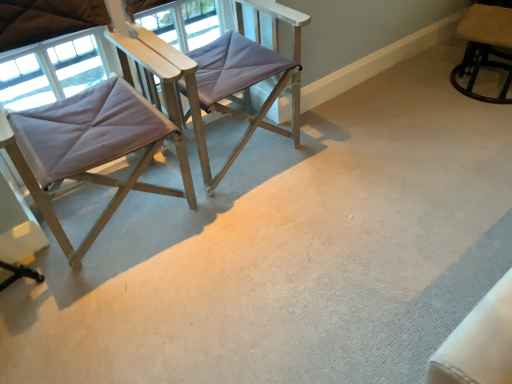
This screenshot has height=384, width=512. I want to click on matte purple fabric chair at center, marked as the second chair in a left-to-right arrangement, so click(229, 77).

Locate an element on the screen. The width and height of the screenshot is (512, 384). matte gray fabric chair at left, placed as the 3th chair when sorted from right to left is located at coordinates pos(91,148).

Where is `matte purple fabric chair at center, marked as the second chair in a left-to-right arrangement`? The image size is (512, 384). matte purple fabric chair at center, marked as the second chair in a left-to-right arrangement is located at coordinates (229, 77).

Which is in front, matte purple fabric chair at center, marked as the 2th chair in a right-to-left arrangement, or matte gray fabric chair at left, marked as the first chair in a left-to-right arrangement?

matte gray fabric chair at left, marked as the first chair in a left-to-right arrangement.

Is there a large distance between matte purple fabric chair at center, marked as the second chair in a left-to-right arrangement, and matte gray fabric chair at left, placed as the 3th chair when sorted from right to left?

They are positioned close to each other.

Where is `chair in front of the matte purple fabric chair at center, marked as the 2th chair in a right-to-left arrangement`? chair in front of the matte purple fabric chair at center, marked as the 2th chair in a right-to-left arrangement is located at coordinates (91, 148).

Can you confirm if matte purple fabric chair at center, marked as the 2th chair in a right-to-left arrangement, is taller than matte gray fabric chair at left, placed as the 3th chair when sorted from right to left?

In fact, matte purple fabric chair at center, marked as the 2th chair in a right-to-left arrangement, may be shorter than matte gray fabric chair at left, placed as the 3th chair when sorted from right to left.

Is beige fabric chair at upper right, the first chair when ordered from right to left, closer to camera compared to matte gray fabric chair at left, marked as the first chair in a left-to-right arrangement?

No, it is not.

In the scene shown: From the image's perspective, between beige fabric chair at upper right, which is counted as the 3th chair, starting from the left, and matte gray fabric chair at left, placed as the 3th chair when sorted from right to left, who is located below?

From the image's view, matte gray fabric chair at left, placed as the 3th chair when sorted from right to left, is below.

Which point is more forward, (504, 90) or (31, 164)?

The point (31, 164) is closer.

Does matte gray fabric chair at left, placed as the 3th chair when sorted from right to left, appear on the left side of matte purple fabric chair at center, marked as the second chair in a left-to-right arrangement?

Correct, you'll find matte gray fabric chair at left, placed as the 3th chair when sorted from right to left, to the left of matte purple fabric chair at center, marked as the second chair in a left-to-right arrangement.

Does matte gray fabric chair at left, marked as the first chair in a left-to-right arrangement, turn towards matte purple fabric chair at center, marked as the 2th chair in a right-to-left arrangement?

No, matte gray fabric chair at left, marked as the first chair in a left-to-right arrangement, is not turned towards matte purple fabric chair at center, marked as the 2th chair in a right-to-left arrangement.

Starting from the matte gray fabric chair at left, marked as the first chair in a left-to-right arrangement, which chair is the 1st one to the right? Please provide its 2D coordinates.

[(229, 77)]

Which is closer to the camera, (48, 204) or (250, 82)?

Point (48, 204) is positioned closer to the camera compared to point (250, 82).

In the image, is matte purple fabric chair at center, marked as the second chair in a left-to-right arrangement, positioned in front of or behind beige fabric chair at upper right, which is counted as the 3th chair, starting from the left?

matte purple fabric chair at center, marked as the second chair in a left-to-right arrangement, is positioned closer to the viewer than beige fabric chair at upper right, which is counted as the 3th chair, starting from the left.

Choose the correct answer: Is matte purple fabric chair at center, marked as the second chair in a left-to-right arrangement, inside beige fabric chair at upper right, which is counted as the 3th chair, starting from the left, or outside it?

The correct answer is: outside.

Does point (250, 120) come in front of point (485, 38)?

No, (250, 120) is behind (485, 38).

Considering the relative sizes of matte purple fabric chair at center, marked as the 2th chair in a right-to-left arrangement, and beige fabric chair at upper right, the first chair when ordered from right to left, in the image provided, is matte purple fabric chair at center, marked as the 2th chair in a right-to-left arrangement, smaller than beige fabric chair at upper right, the first chair when ordered from right to left,?

Actually, matte purple fabric chair at center, marked as the 2th chair in a right-to-left arrangement, might be larger than beige fabric chair at upper right, the first chair when ordered from right to left.

Locate an element on the screen. chair below the matte purple fabric chair at center, marked as the second chair in a left-to-right arrangement (from a real-world perspective) is located at coordinates click(x=484, y=47).

Considering the relative sizes of beige fabric chair at upper right, the first chair when ordered from right to left, and matte purple fabric chair at center, marked as the second chair in a left-to-right arrangement, in the image provided, is beige fabric chair at upper right, the first chair when ordered from right to left, shorter than matte purple fabric chair at center, marked as the second chair in a left-to-right arrangement,?

Yes.

Is beige fabric chair at upper right, which is counted as the 3th chair, starting from the left, to the left of matte purple fabric chair at center, marked as the 2th chair in a right-to-left arrangement, from the viewer's perspective?

In fact, beige fabric chair at upper right, which is counted as the 3th chair, starting from the left, is to the right of matte purple fabric chair at center, marked as the 2th chair in a right-to-left arrangement.

From the image's perspective, is beige fabric chair at upper right, which is counted as the 3th chair, starting from the left, located above or below matte purple fabric chair at center, marked as the second chair in a left-to-right arrangement?

From the image's perspective, beige fabric chair at upper right, which is counted as the 3th chair, starting from the left, appears above matte purple fabric chair at center, marked as the second chair in a left-to-right arrangement.

Does matte gray fabric chair at left, placed as the 3th chair when sorted from right to left, have a lesser width compared to beige fabric chair at upper right, the first chair when ordered from right to left?

No.

Is matte gray fabric chair at left, placed as the 3th chair when sorted from right to left, bigger than beige fabric chair at upper right, the first chair when ordered from right to left?

Correct, matte gray fabric chair at left, placed as the 3th chair when sorted from right to left, is larger in size than beige fabric chair at upper right, the first chair when ordered from right to left.

Which is in front, point (98, 163) or point (468, 43)?

The point (98, 163) is more forward.

Find the location of a particular element. The width and height of the screenshot is (512, 384). the 1st chair positioned above the matte gray fabric chair at left, placed as the 3th chair when sorted from right to left (from the image's perspective) is located at coordinates (229, 77).

The height and width of the screenshot is (384, 512). I want to click on chair that is the 2nd one when counting leftward from the beige fabric chair at upper right, which is counted as the 3th chair, starting from the left, so click(x=91, y=148).

Looking at the image, which one is located further to matte purple fabric chair at center, marked as the 2th chair in a right-to-left arrangement, matte gray fabric chair at left, marked as the first chair in a left-to-right arrangement, or beige fabric chair at upper right, which is counted as the 3th chair, starting from the left?

beige fabric chair at upper right, which is counted as the 3th chair, starting from the left, is positioned further to the anchor matte purple fabric chair at center, marked as the 2th chair in a right-to-left arrangement.

Which object lies nearer to the anchor point beige fabric chair at upper right, which is counted as the 3th chair, starting from the left, matte gray fabric chair at left, marked as the first chair in a left-to-right arrangement, or matte purple fabric chair at center, marked as the second chair in a left-to-right arrangement?

matte purple fabric chair at center, marked as the second chair in a left-to-right arrangement, is closer to beige fabric chair at upper right, which is counted as the 3th chair, starting from the left.

From the picture: Considering their positions, is beige fabric chair at upper right, the first chair when ordered from right to left, positioned closer to matte purple fabric chair at center, marked as the 2th chair in a right-to-left arrangement, than matte gray fabric chair at left, placed as the 3th chair when sorted from right to left?

matte gray fabric chair at left, placed as the 3th chair when sorted from right to left, is positioned closer to the anchor matte purple fabric chair at center, marked as the 2th chair in a right-to-left arrangement.

Considering their positions, is matte purple fabric chair at center, marked as the second chair in a left-to-right arrangement, positioned closer to beige fabric chair at upper right, the first chair when ordered from right to left, than matte gray fabric chair at left, marked as the first chair in a left-to-right arrangement?

matte purple fabric chair at center, marked as the second chair in a left-to-right arrangement, is closer to beige fabric chair at upper right, the first chair when ordered from right to left.

Considering their positions, is matte purple fabric chair at center, marked as the second chair in a left-to-right arrangement, positioned closer to matte gray fabric chair at left, marked as the first chair in a left-to-right arrangement, than beige fabric chair at upper right, the first chair when ordered from right to left?

matte purple fabric chair at center, marked as the second chair in a left-to-right arrangement, is positioned closer to the anchor matte gray fabric chair at left, marked as the first chair in a left-to-right arrangement.

Looking at the image, which one is located further to matte gray fabric chair at left, placed as the 3th chair when sorted from right to left, beige fabric chair at upper right, the first chair when ordered from right to left, or matte purple fabric chair at center, marked as the second chair in a left-to-right arrangement?

beige fabric chair at upper right, the first chair when ordered from right to left, is further to matte gray fabric chair at left, placed as the 3th chair when sorted from right to left.

Locate an element on the screen. This screenshot has height=384, width=512. chair between matte gray fabric chair at left, placed as the 3th chair when sorted from right to left, and beige fabric chair at upper right, the first chair when ordered from right to left, in the horizontal direction is located at coordinates (229, 77).